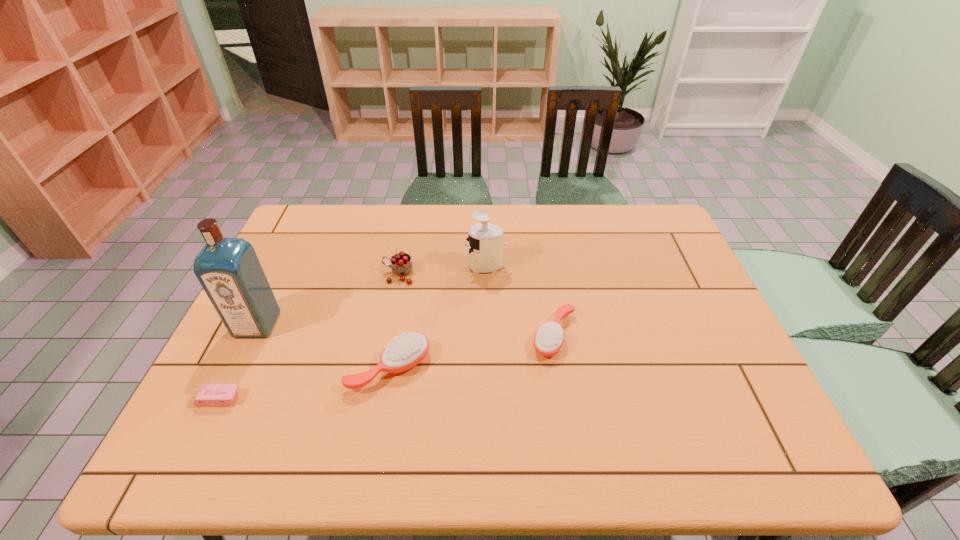
Find the location of a particular element. The width and height of the screenshot is (960, 540). vacant space located 0.310m on the right of the right hairbrush is located at coordinates (695, 336).

Locate an element on the screen. free location located 0.100m on the front of the fifth object from left to right is located at coordinates (487, 298).

Locate an element on the screen. The width and height of the screenshot is (960, 540). free region located on the flat label side of the liquor is located at coordinates (223, 396).

This screenshot has width=960, height=540. I want to click on vacant space located on the handle side of the cherry, so click(x=356, y=274).

This screenshot has height=540, width=960. Find the location of `vacant space located 0.240m on the handle side of the cherry`. vacant space located 0.240m on the handle side of the cherry is located at coordinates (303, 274).

The image size is (960, 540). I want to click on free location located on the handle side of the cherry, so click(x=303, y=274).

Find the location of a particular element. This screenshot has height=540, width=960. free location located 0.120m on the right of the shortest object is located at coordinates (291, 399).

This screenshot has width=960, height=540. What are the coordinates of `hairbrush situated at the near edge` in the screenshot? It's located at (406, 351).

The height and width of the screenshot is (540, 960). What are the coordinates of `eraser that is at the near edge` in the screenshot? It's located at (209, 395).

Find the location of a particular element. The image size is (960, 540). liquor present at the left edge is located at coordinates (228, 269).